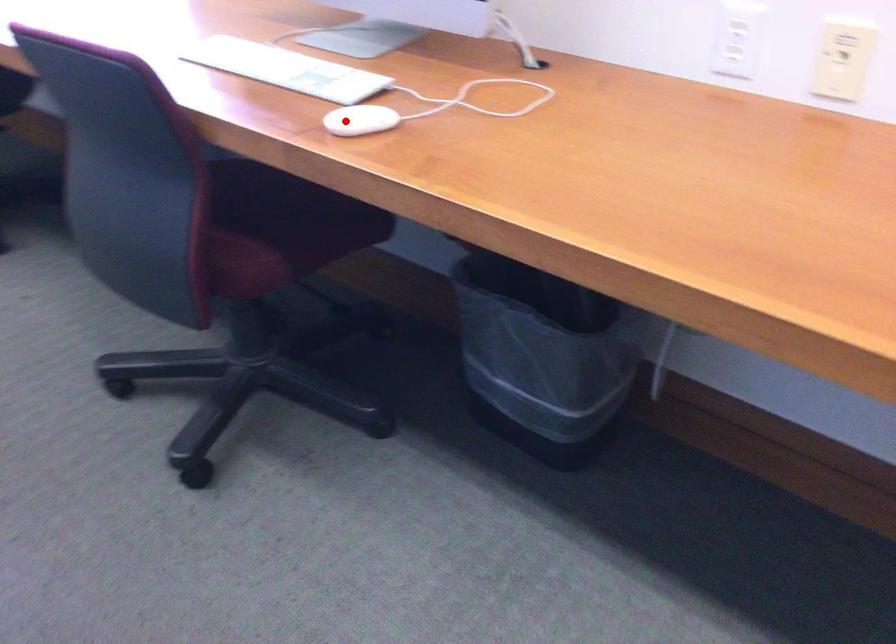
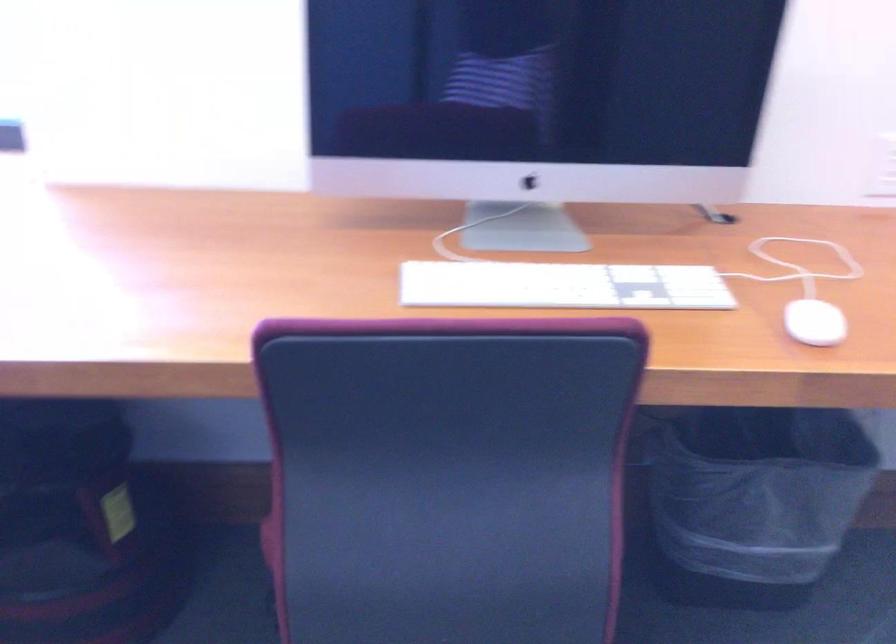
In the second image, find the point that corresponds to the highlighted location in the first image.

(814, 323)